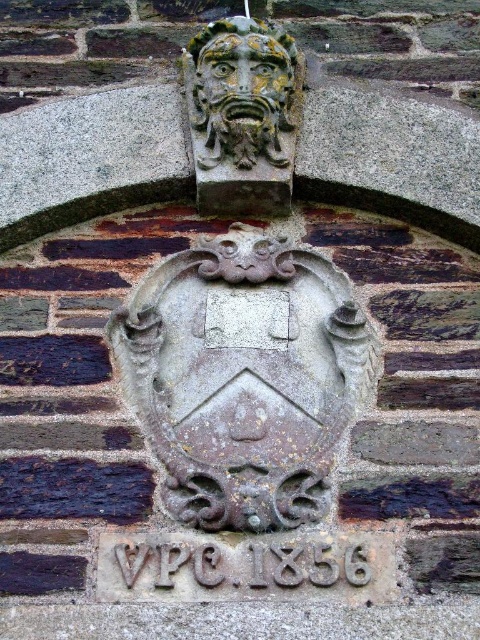
Between gray stone shield at center and carved stone face at upper center, which one appears on the right side from the viewer's perspective?

Positioned to the right is carved stone face at upper center.

Who is higher up, gray stone shield at center or carved stone face at upper center?

carved stone face at upper center is higher up.

Does point (279, 369) come farther from viewer compared to point (223, 131)?

That is False.

The image size is (480, 640). Identify the location of gray stone shield at center. (242, 376).